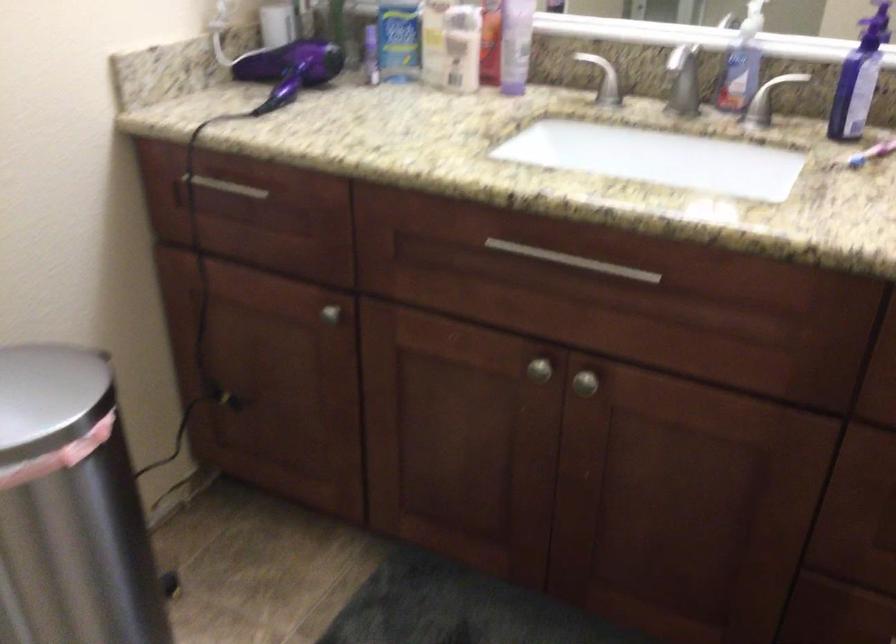
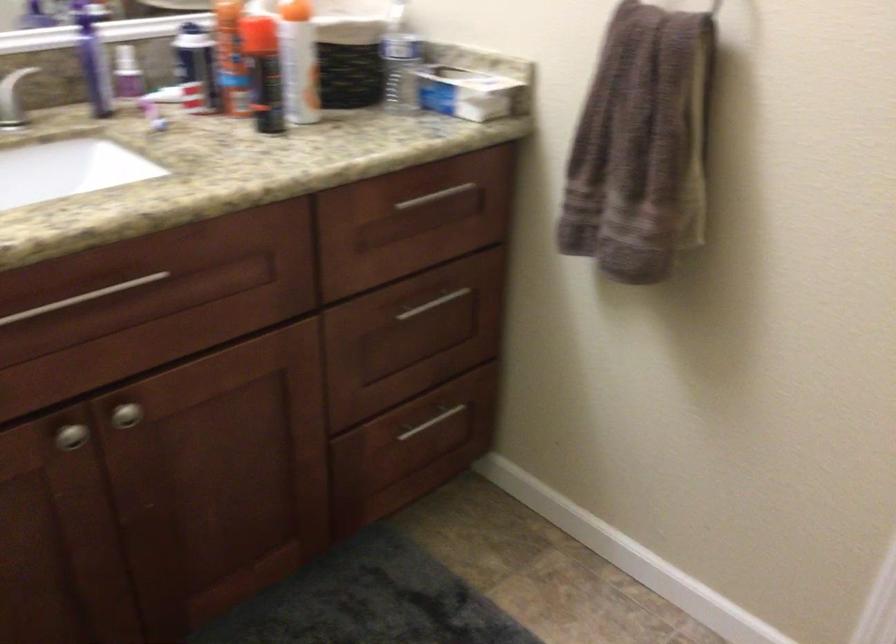
Where in the second image is the point corresponding to [539,368] from the first image?

(71, 436)